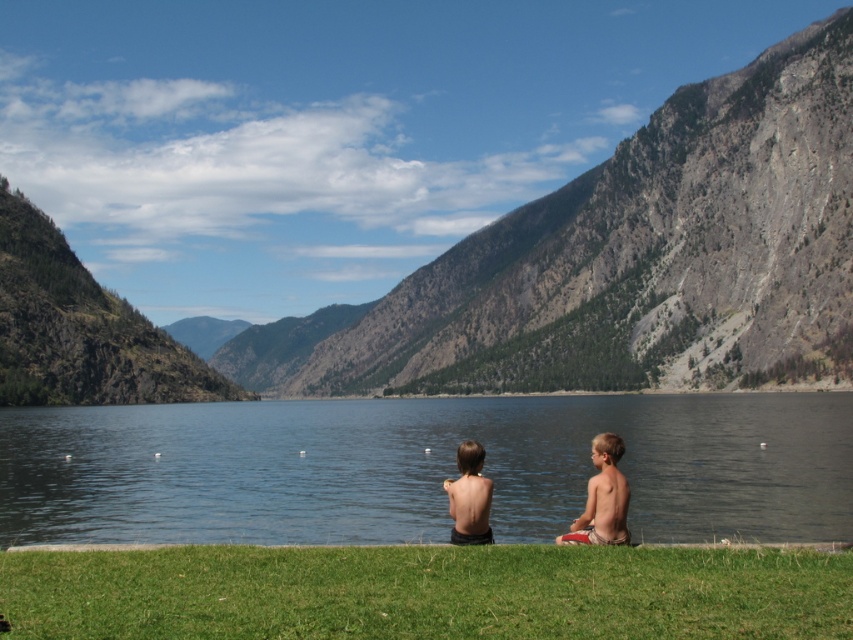
Who is higher up, light brown skin at center or smooth skin child at center?

Positioned higher is smooth skin child at center.

Is light brown skin at center in front of smooth skin child at center?

Yes, it is.

Identify the location of light brown skin at center. (602, 499).

Which of these two, clear water at center or green grass at lower center, stands shorter?

Standing shorter between the two is green grass at lower center.

Based on the photo, is clear water at center in front of green grass at lower center?

No, it is not.

Between point (108, 410) and point (74, 621), which one is positioned behind?

Point (108, 410)

You are a GUI agent. You are given a task and a screenshot of the screen. Output one action in this format:
    pyautogui.click(x=<x>, y=<y>)
    Task: Click on the clear water at center
    
    Given the screenshot: What is the action you would take?
    pyautogui.click(x=422, y=467)

Between point (97, 579) and point (563, 538), which one is positioned in front?

Point (97, 579) is more forward.

Can you confirm if green grass at lower center is positioned to the right of light brown skin at center?

In fact, green grass at lower center is to the left of light brown skin at center.

I want to click on green grass at lower center, so click(427, 593).